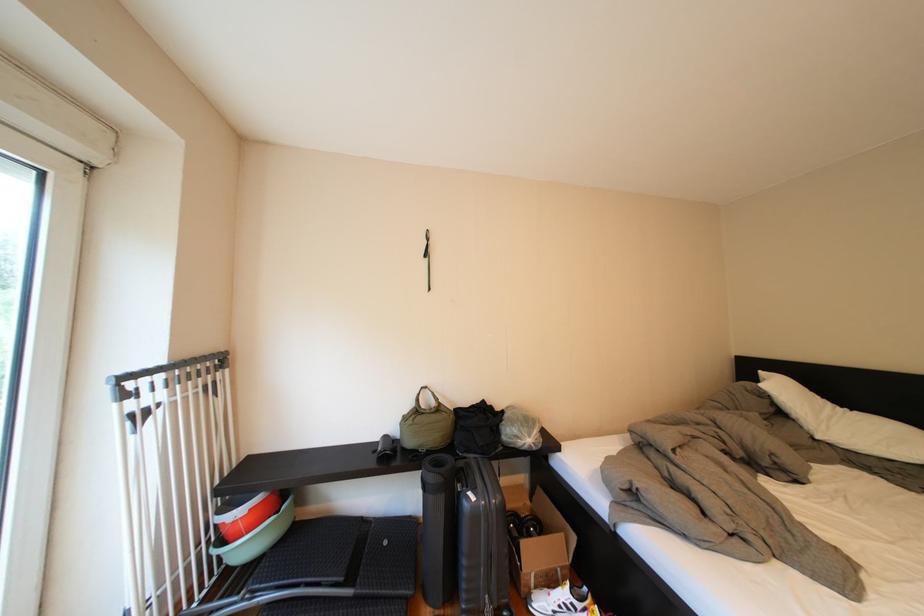
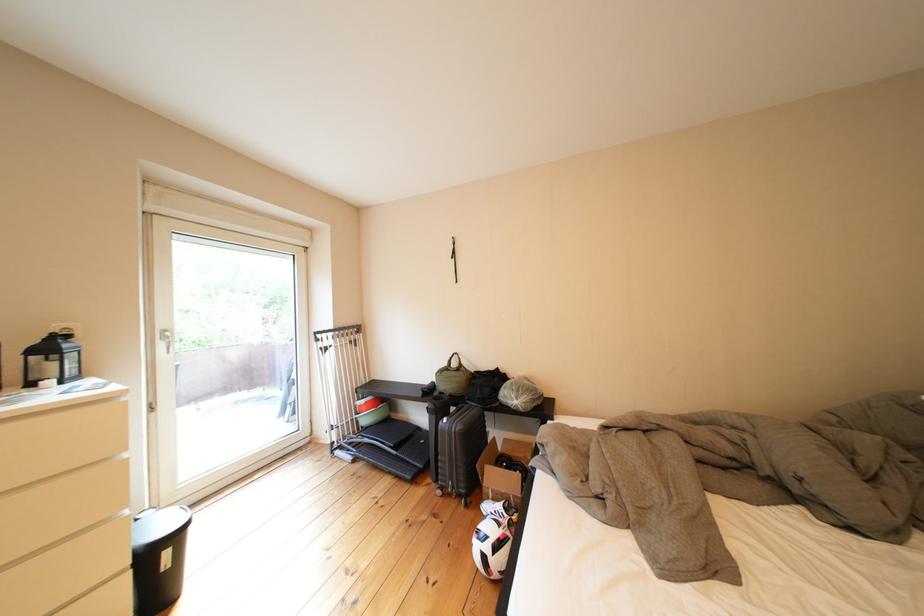
The point at (544,557) is marked in the first image. Where is the corresponding point in the second image?

(505, 480)